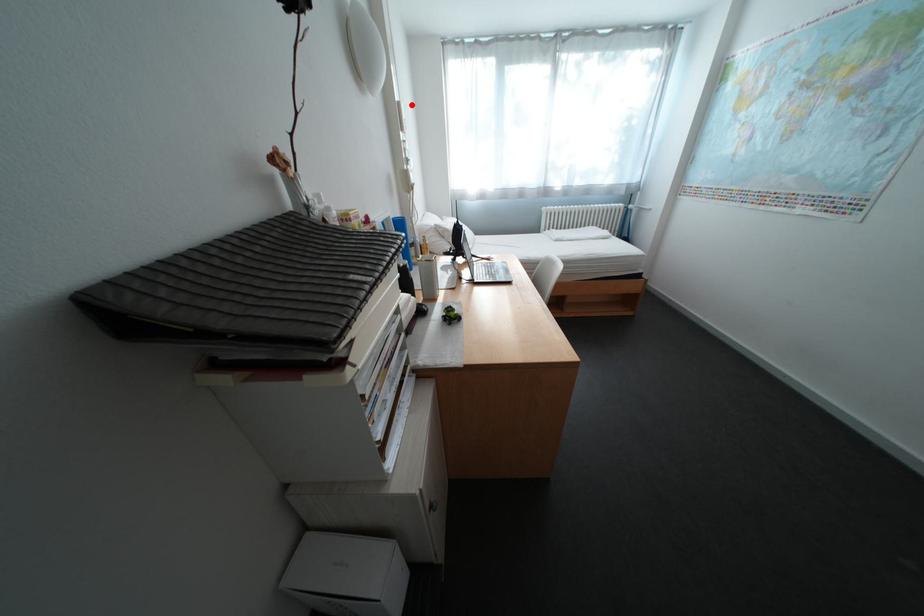
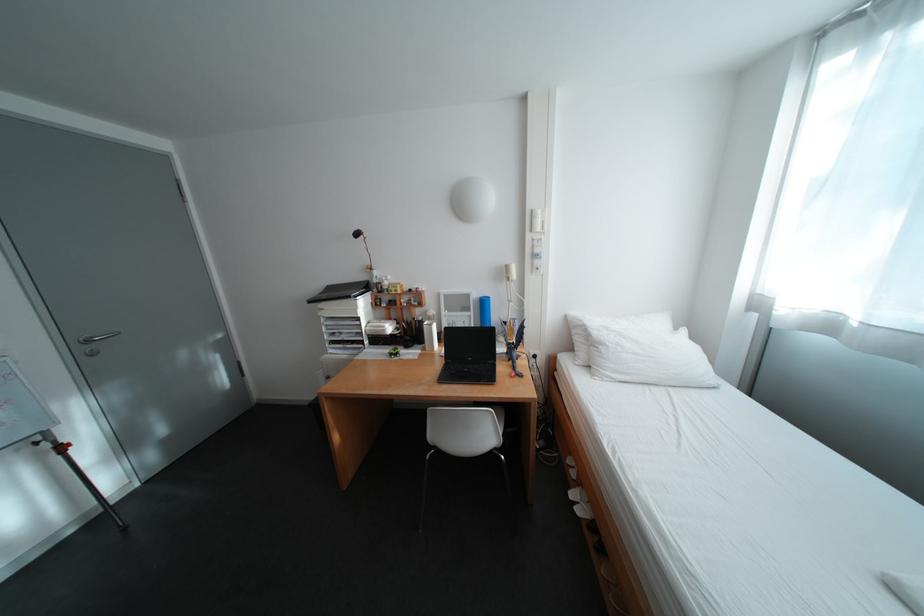
Question: I am providing you with two images of the same scene from different viewpoints. A red point is marked on the first image. Is the red point's position out of view in image 2?

Choices:
 (A) Yes
 (B) No

Answer: (B)